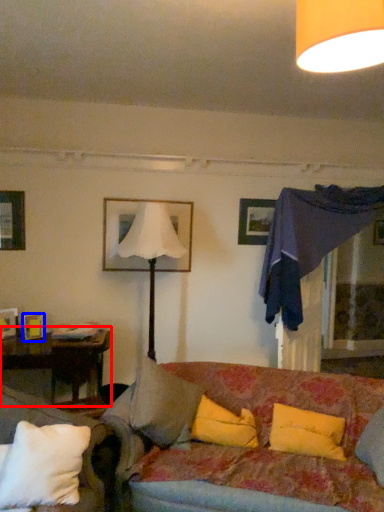
Question: Which object appears farthest to the camera in this image, table (highlighted by a red box) or picture frame (highlighted by a blue box)?

Choices:
 (A) table
 (B) picture frame

Answer: (B)